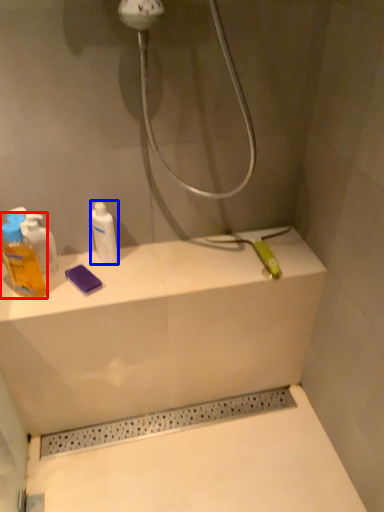
Question: Among these objects, which one is nearest to the camera, mouthwash (highlighted by a red box) or mouthwash (highlighted by a blue box)?

Choices:
 (A) mouthwash
 (B) mouthwash

Answer: (A)